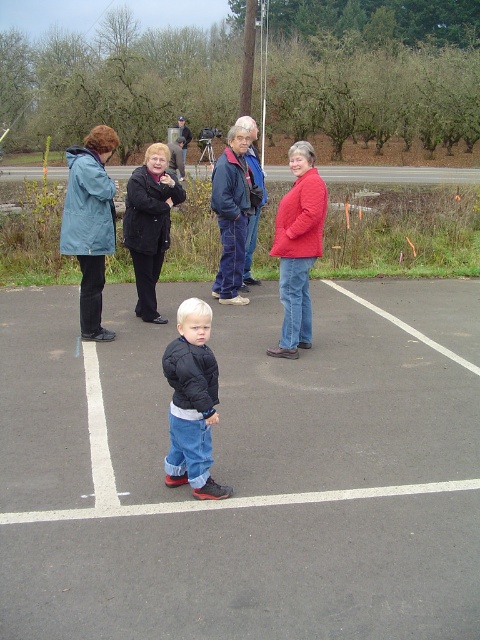
Between matte red jacket at center and black plastic tripod at center, which one has less height?

black plastic tripod at center

You are a GUI agent. You are given a task and a screenshot of the screen. Output one action in this format:
    pyautogui.click(x=<x>, y=<y>)
    Task: Click on the matte red jacket at center
    This screenshot has height=640, width=480.
    Given the screenshot: What is the action you would take?
    pyautogui.click(x=298, y=248)

Measure the distance between blue waterproof jacket at left and black plastic tripod at center.

26.58 meters

Is blue waterproof jacket at left to the left of black plastic tripod at center from the viewer's perspective?

Incorrect, blue waterproof jacket at left is not on the left side of black plastic tripod at center.

You are a GUI agent. You are given a task and a screenshot of the screen. Output one action in this format:
    pyautogui.click(x=<x>, y=<y>)
    Task: Click on the blue waterproof jacket at left
    The height and width of the screenshot is (640, 480).
    Given the screenshot: What is the action you would take?
    pyautogui.click(x=90, y=221)

You are a GUI agent. You are given a task and a screenshot of the screen. Output one action in this format:
    pyautogui.click(x=<x>, y=<y>)
    Task: Click on the blue waterproof jacket at left
    The image size is (480, 640).
    Given the screenshot: What is the action you would take?
    pyautogui.click(x=90, y=221)

Based on the photo, is dark blue jacket at center positioned behind black matte jacket at center?

No, it is not.

From the picture: Is dark blue jacket at center bigger than black matte jacket at center?

Actually, dark blue jacket at center might be smaller than black matte jacket at center.

Who is more forward, [200,353] or [127,214]?

Point [200,353] is more forward.

Find the location of `dark blue jacket at center`. dark blue jacket at center is located at coordinates (192, 401).